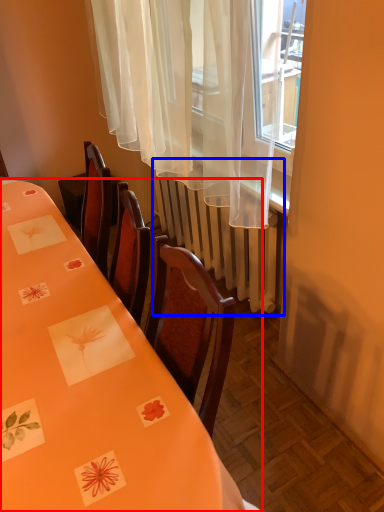
Question: Which object appears farthest to the camera in this image, table (highlighted by a red box) or radiator (highlighted by a blue box)?

Choices:
 (A) table
 (B) radiator

Answer: (B)